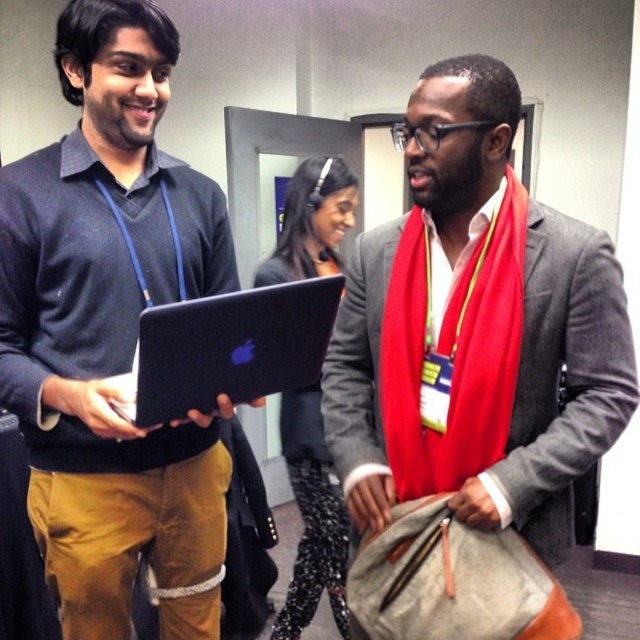
Question: Considering the real-world distances, which object is farthest from the black glossy laptop at center?

Choices:
 (A) black matte laptop at center
 (B) matte black laptop at center
 (C) matte gray blazer at center

Answer: (C)

Question: Which point appears farthest from the camera in this image?

Choices:
 (A) (413, 320)
 (B) (166, 323)
 (C) (92, 97)
 (D) (342, 164)

Answer: (D)

Question: Can you confirm if matte black laptop at center is thinner than black matte laptop at center?

Choices:
 (A) yes
 (B) no

Answer: (B)

Question: In this image, where is matte black laptop at center located relative to black matte laptop at center?

Choices:
 (A) right
 (B) left

Answer: (B)

Question: Is matte black laptop at center above black glossy laptop at center?

Choices:
 (A) no
 (B) yes

Answer: (B)

Question: Which of the following is the closest to the observer?

Choices:
 (A) black matte laptop at center
 (B) matte gray blazer at center
 (C) matte black laptop at center
 (D) black glossy laptop at center

Answer: (A)